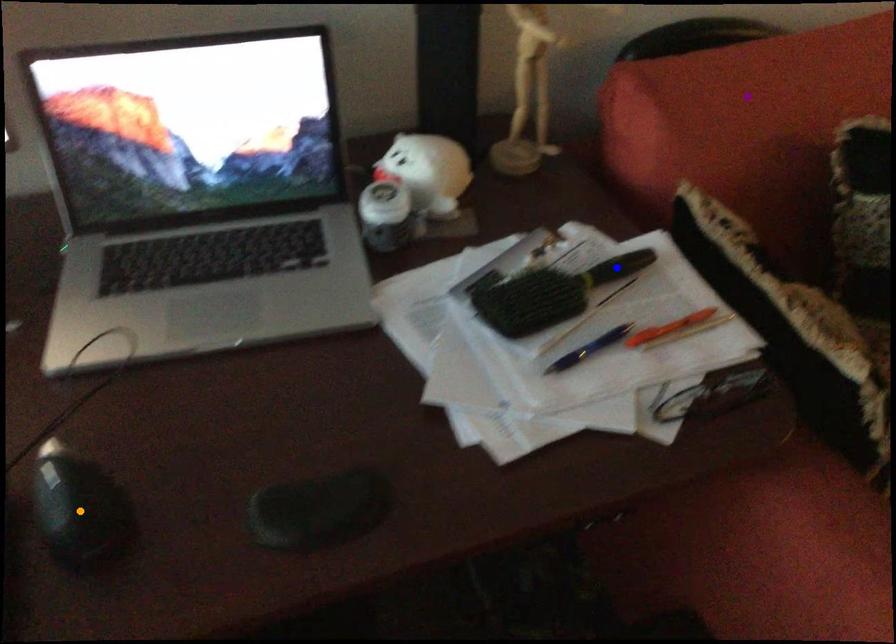
Order these from nearest to farthest:
- orange point
- blue point
- purple point

orange point < blue point < purple point